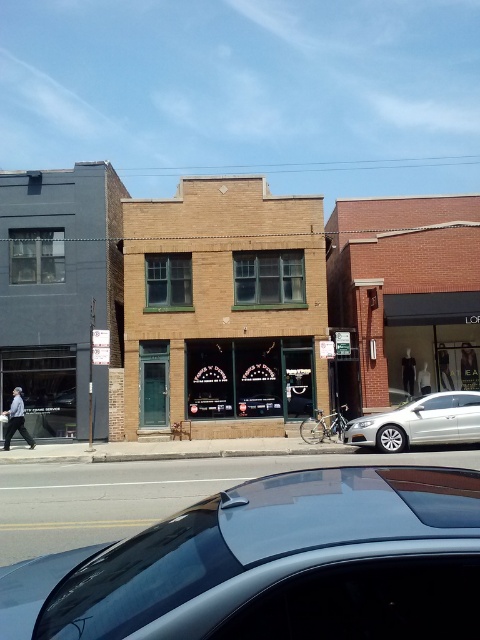
You are a delivery person needing to park your car in front of the central building. The dark gray concrete building at left and the silver metallic sedan at lower right are in your way. Which obstacle must you move first to access the central building?

The silver metallic sedan at lower right is behind the dark gray concrete building at left. Therefore, you must move the dark gray concrete building at left first to access the central building, as the sedan is already positioned behind it and not blocking the direct path.